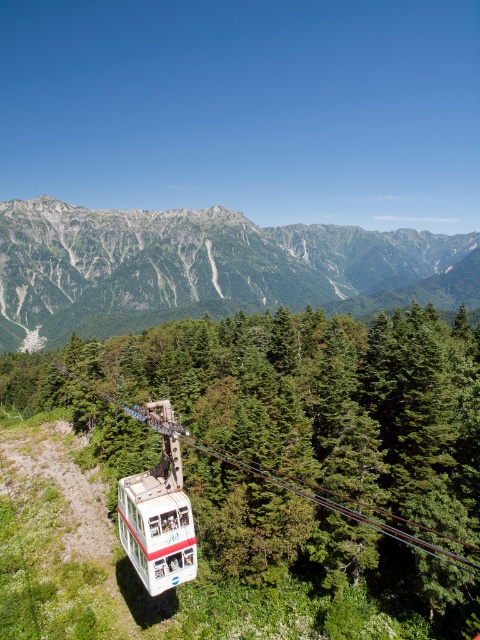
Question: Is green textured mountain at center wider than white matte cable car at center?

Choices:
 (A) yes
 (B) no

Answer: (A)

Question: Can you confirm if green textured mountain at center is thinner than white matte cable car at center?

Choices:
 (A) no
 (B) yes

Answer: (A)

Question: Is green textured mountain at center to the right of white matte cable car at center from the viewer's perspective?

Choices:
 (A) no
 (B) yes

Answer: (B)

Question: Which object is farther from the camera taking this photo?

Choices:
 (A) white matte cable car at center
 (B) green textured mountain at center

Answer: (B)